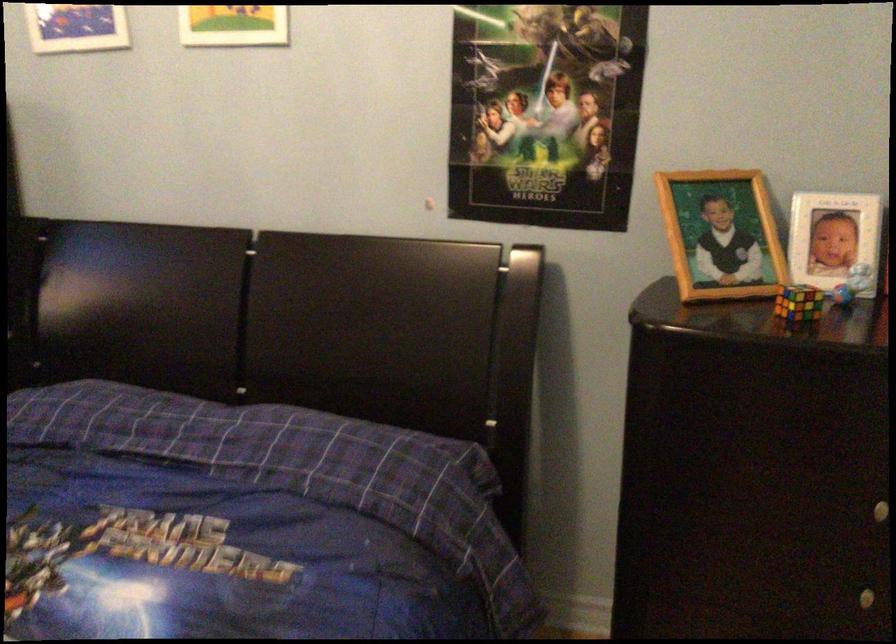
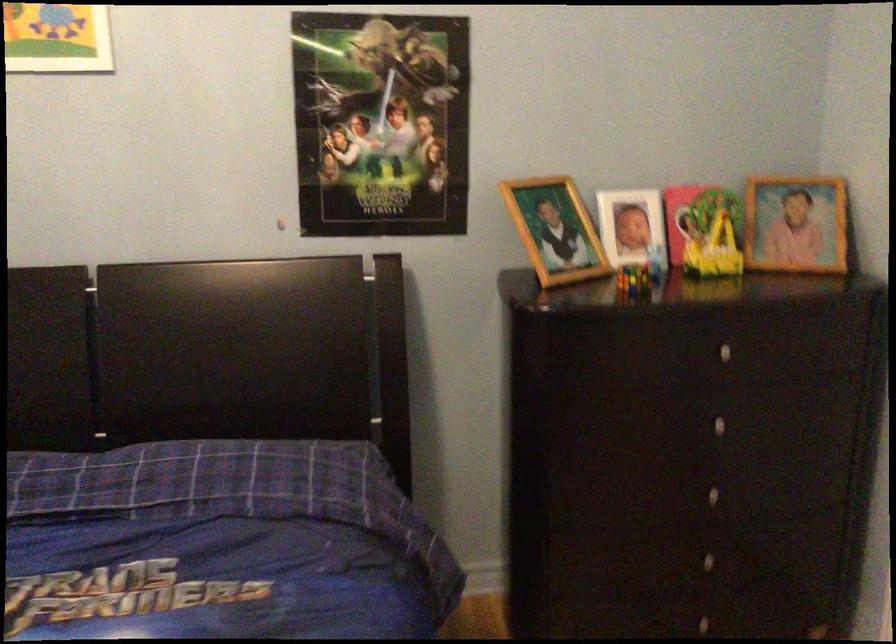
The point at (721,240) is marked in the first image. Where is the corresponding point in the second image?

(555, 230)